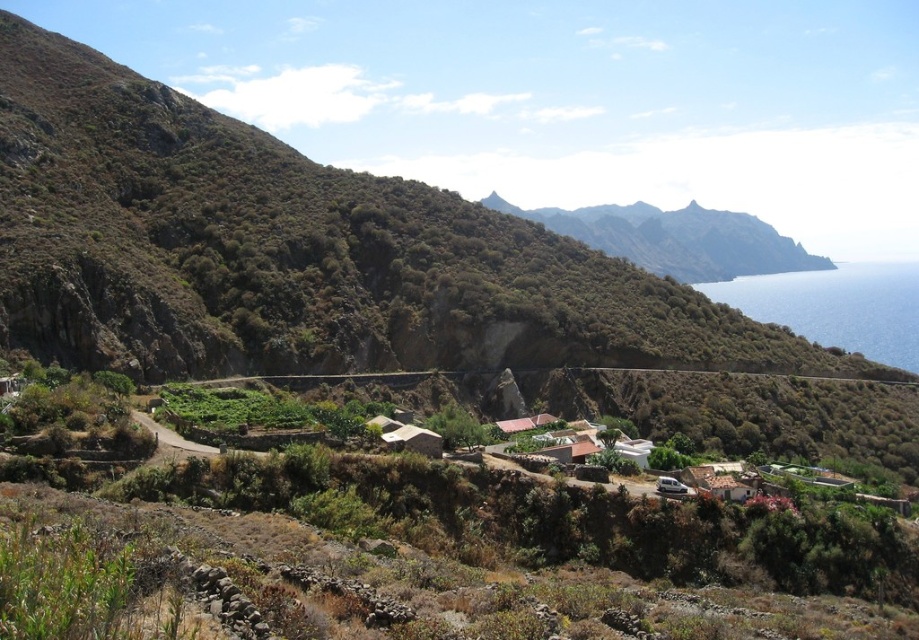
Question: Can you confirm if green textured mountain at upper center is wider than blue water at right?

Choices:
 (A) yes
 (B) no

Answer: (B)

Question: Which object appears farthest from the camera in this image?

Choices:
 (A) green textured mountain at upper center
 (B) blue water at right

Answer: (A)

Question: Is green textured mountain at upper center above blue water at right?

Choices:
 (A) yes
 (B) no

Answer: (A)

Question: Which point is closer to the camera taking this photo?

Choices:
 (A) (894, 276)
 (B) (600, 212)

Answer: (B)

Question: Observing the image, what is the correct spatial positioning of green textured mountain at upper center in reference to blue water at right?

Choices:
 (A) left
 (B) right

Answer: (A)

Question: Among these points, which one is farthest from the camera?

Choices:
 (A) (824, 324)
 (B) (686, 221)

Answer: (B)